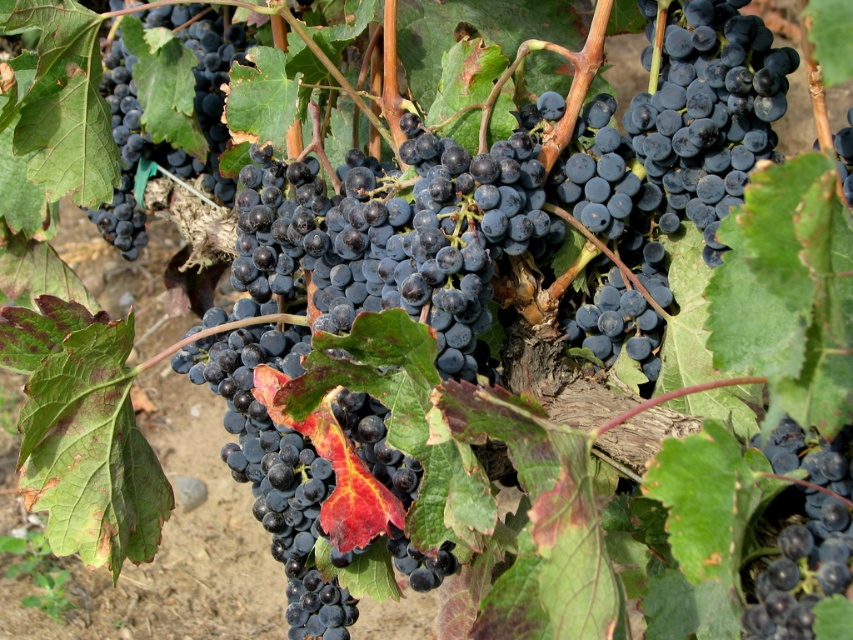
Which of these two, shiny dark blue grapes at upper left or shiny dark blue grape at center, stands taller?

With more height is shiny dark blue grapes at upper left.

Does shiny dark blue grapes at upper left have a larger size compared to shiny dark blue grape at center?

Yes.

Which is behind, point (119, 214) or point (850, 160)?

The point (119, 214) is behind.

Image resolution: width=853 pixels, height=640 pixels. Identify the location of shiny dark blue grapes at upper left. (155, 108).

Can you confirm if shiny dark blue grapes at center is thinner than shiny dark blue grape at center?

Correct, shiny dark blue grapes at center's width is less than shiny dark blue grape at center's.

Which is more to the left, shiny dark blue grapes at center or shiny dark blue grape at center?

shiny dark blue grapes at center

Identify the location of shiny dark blue grapes at center. (804, 534).

The image size is (853, 640). I want to click on shiny dark blue grapes at center, so click(x=804, y=534).

Can you confirm if shiny dark blue grapes at upper left is shorter than shiny dark blue grapes at center?

No.

Which is more to the right, shiny dark blue grapes at upper left or shiny dark blue grapes at center?

Positioned to the right is shiny dark blue grapes at center.

Between point (108, 232) and point (798, 536), which one is positioned behind?

The point (108, 232) is behind.

The width and height of the screenshot is (853, 640). What are the coordinates of `shiny dark blue grapes at upper left` in the screenshot? It's located at (155, 108).